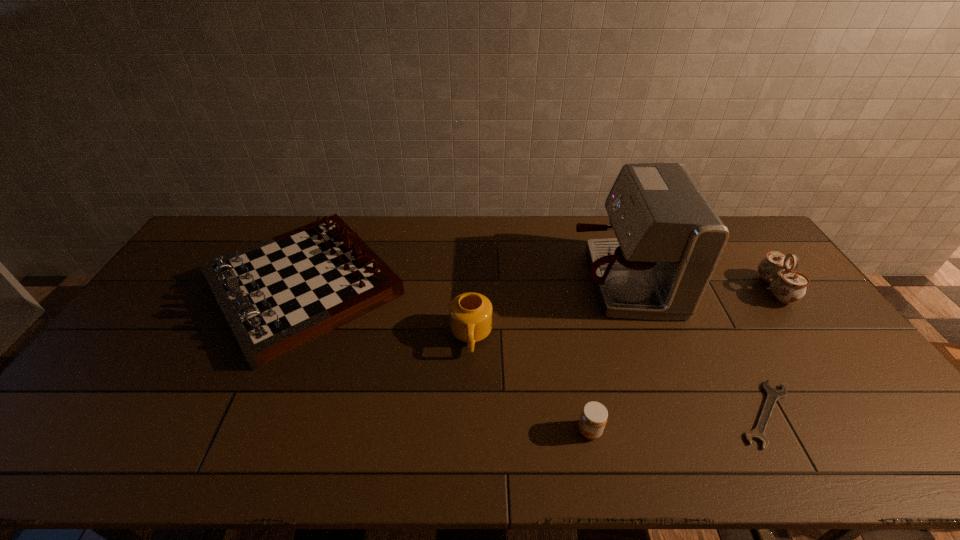
Find the location of a particular element. The height and width of the screenshot is (540, 960). free location located 0.300m on the right of the leftmost object is located at coordinates (499, 286).

The width and height of the screenshot is (960, 540). Find the location of `vacant area situated by the handle of the chinaware`. vacant area situated by the handle of the chinaware is located at coordinates (664, 289).

Where is `vacant space located 0.240m by the handle of the chinaware`? vacant space located 0.240m by the handle of the chinaware is located at coordinates (686, 289).

Where is `vacant space located 0.290m by the handle of the chinaware`? vacant space located 0.290m by the handle of the chinaware is located at coordinates (671, 289).

Locate an element on the screen. The image size is (960, 540). free region located 0.120m on the handle side of the second object from left to right is located at coordinates (469, 398).

The height and width of the screenshot is (540, 960). I want to click on vacant space situated on the front label of the jam, so click(502, 431).

Locate an element on the screen. The image size is (960, 540). vacant space situated on the front label of the jam is located at coordinates (515, 431).

I want to click on vacant space situated 0.350m on the front label of the jam, so coord(431,431).

Find the location of `free space located on the back of the wrench`. free space located on the back of the wrench is located at coordinates (717, 322).

The image size is (960, 540). Find the location of `coffee maker at the far edge`. coffee maker at the far edge is located at coordinates (669, 239).